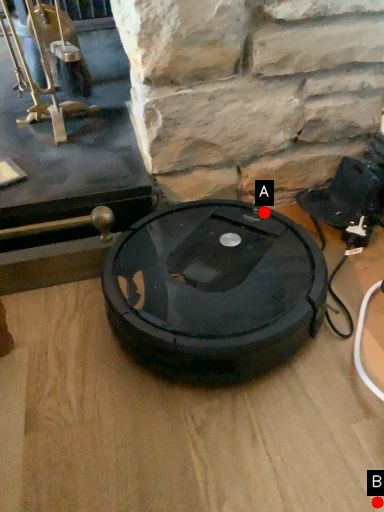
Question: Two points are circled on the image, labeled by A and B beside each circle. Which point is closer to the camera?

Choices:
 (A) A is closer
 (B) B is closer

Answer: (B)